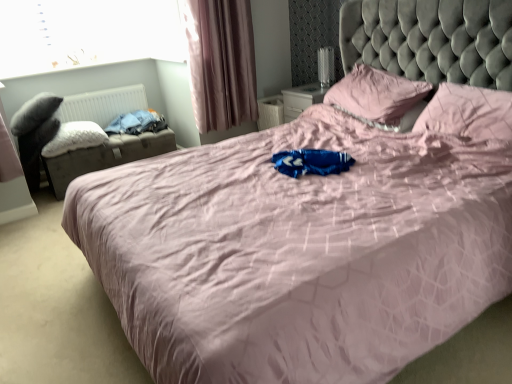
What do you see at coordinates (137, 123) in the screenshot? This screenshot has height=384, width=512. I see `blue cotton clothes at left` at bounding box center [137, 123].

The width and height of the screenshot is (512, 384). Find the location of `white fluffy pillow at left, placed as the 3th pillow when sorted from right to left`. white fluffy pillow at left, placed as the 3th pillow when sorted from right to left is located at coordinates (74, 138).

In order to click on velvet black swivel chair at left in this screenshot , I will do `click(35, 132)`.

Identify the location of pink fabric curtain at upper left. (221, 62).

Which is nearer, (x=85, y=16) or (x=46, y=128)?

Point (x=85, y=16) is farther from the camera than point (x=46, y=128).

Looking at their sizes, would you say transparent glass window at upper left is wider or thinner than velvet black swivel chair at left?

Clearly, transparent glass window at upper left has less width compared to velvet black swivel chair at left.

From the image's perspective, is transparent glass window at upper left beneath velvet black swivel chair at left?

Actually, transparent glass window at upper left appears above velvet black swivel chair at left in the image.

From a real-world perspective, who is located higher, transparent glass window at upper left or velvet black swivel chair at left?

From a 3D spatial view, transparent glass window at upper left is above.

Does pink fabric pillow at upper center, the 2th pillow in the left-to-right sequence, turn towards white fluffy pillow at left, placed as the 3th pillow when sorted from right to left?

No, pink fabric pillow at upper center, the 2th pillow in the left-to-right sequence, is not oriented towards white fluffy pillow at left, placed as the 3th pillow when sorted from right to left.

This screenshot has width=512, height=384. I want to click on pillow that appears above the white fluffy pillow at left, placed as the 3th pillow when sorted from right to left (from the image's perspective), so click(379, 98).

In terms of height, does pink fabric pillow at upper center, the second pillow in the right-to-left sequence, look taller or shorter compared to white fluffy pillow at left, the 1th pillow viewed from the left?

In the image, pink fabric pillow at upper center, the second pillow in the right-to-left sequence, appears to be taller than white fluffy pillow at left, the 1th pillow viewed from the left.

Is transparent glass window at upper left aimed at pink fabric curtain at upper left?

Yes, transparent glass window at upper left is aimed at pink fabric curtain at upper left.

Can we say transparent glass window at upper left lies outside pink fabric curtain at upper left?

transparent glass window at upper left lies outside pink fabric curtain at upper left's area.

Does transparent glass window at upper left have a lesser width compared to pink fabric curtain at upper left?

Yes.

Is transparent glass window at upper left not near pink fabric curtain at upper left?

No, transparent glass window at upper left is not far from pink fabric curtain at upper left.

Which of these two, leatherette storage ottoman at left or pink fabric curtain at upper left, stands taller?

Standing taller between the two is pink fabric curtain at upper left.

Can we say leatherette storage ottoman at left lies outside pink fabric curtain at upper left?

Yes, leatherette storage ottoman at left is outside of pink fabric curtain at upper left.

Which is closer, [79,171] or [204,88]?

Point [79,171] is closer to the camera than point [204,88].

Consider the image. Who is more distant, leatherette storage ottoman at left or pink fabric curtain at upper left?

leatherette storage ottoman at left is further from the camera.

Locate an element on the screen. pillow that is the 2nd object above the velvet black swivel chair at left (from a real-world perspective) is located at coordinates pyautogui.click(x=379, y=98).

Between velvet black swivel chair at left and pink fabric pillow at upper center, the second pillow in the right-to-left sequence, which one has smaller width?

Thinner between the two is pink fabric pillow at upper center, the second pillow in the right-to-left sequence.

Is velvet black swivel chair at left to the right of pink fabric pillow at upper center, the 2th pillow in the left-to-right sequence, from the viewer's perspective?

No, velvet black swivel chair at left is not to the right of pink fabric pillow at upper center, the 2th pillow in the left-to-right sequence.

Consider the image. Does velvet black swivel chair at left have a lesser height compared to white plastic radiator at left?

No, velvet black swivel chair at left is not shorter than white plastic radiator at left.

What are the coordinates of `radiator on the right of velvet black swivel chair at left` in the screenshot? It's located at (103, 105).

In the scene shown: Which is more distant, [11,125] or [96,118]?

Point [96,118]

Consider the image. Could blue cotton clothes at left be considered to be inside pink fabric pillow at upper center, the second pillow in the right-to-left sequence?

Actually, blue cotton clothes at left is outside pink fabric pillow at upper center, the second pillow in the right-to-left sequence.

Is pink fabric pillow at upper center, the 2th pillow in the left-to-right sequence, aimed at blue cotton clothes at left?

No, pink fabric pillow at upper center, the 2th pillow in the left-to-right sequence, is not oriented towards blue cotton clothes at left.

Considering their positions, is pink fabric pillow at upper center, the second pillow in the right-to-left sequence, located in front of or behind blue cotton clothes at left?

pink fabric pillow at upper center, the second pillow in the right-to-left sequence, is positioned closer to the viewer than blue cotton clothes at left.

Which of these two, pink fabric pillow at upper center, the 2th pillow in the left-to-right sequence, or blue cotton clothes at left, is smaller?

With smaller size is blue cotton clothes at left.

Image resolution: width=512 pixels, height=384 pixels. What are the coordinates of `swivel chair directly beneath the transparent glass window at upper left (from a real-world perspective)` in the screenshot? It's located at (x=35, y=132).

Locate an element on the screen. The height and width of the screenshot is (384, 512). the 1st pillow counting from the right side of the white fluffy pillow at left, the 1th pillow viewed from the left is located at coordinates (379, 98).

Based on their spatial positions, is velvet black swivel chair at left or pink fabric pillow at upper center, the 2th pillow in the left-to-right sequence, further from pink fabric curtain at upper left?

velvet black swivel chair at left.

From the image, which object appears to be nearer to pink fabric curtain at upper left, pink fabric pillow at upper right, the 3th pillow when ordered from left to right, or pink fabric pillow at upper center, the second pillow in the right-to-left sequence?

pink fabric pillow at upper center, the second pillow in the right-to-left sequence, lies closer to pink fabric curtain at upper left than the other object.

When comparing their distances from velvet black swivel chair at left, does white fluffy pillow at left, placed as the 3th pillow when sorted from right to left, or blue cotton clothes at left seem further?

Among the two, blue cotton clothes at left is located further to velvet black swivel chair at left.

From the image, which object appears to be nearer to transparent glass window at upper left, blue cotton clothes at left or velvet black swivel chair at left?

Among the two, blue cotton clothes at left is located nearer to transparent glass window at upper left.

Considering their positions, is blue cotton clothes at left positioned closer to pink fabric pillow at upper right, the 3th pillow when ordered from left to right, than transparent glass window at upper left?

Among the two, blue cotton clothes at left is located nearer to pink fabric pillow at upper right, the 3th pillow when ordered from left to right.

When comparing their distances from pink fabric pillow at upper right, the 3th pillow when ordered from left to right, does leatherette storage ottoman at left or white plastic radiator at left seem further?

Among the two, white plastic radiator at left is located further to pink fabric pillow at upper right, the 3th pillow when ordered from left to right.

When comparing their distances from white plastic radiator at left, does velvet black swivel chair at left or blue cotton clothes at left seem closer?

blue cotton clothes at left is positioned closer to the anchor white plastic radiator at left.

Based on their spatial positions, is pink fabric pillow at upper right, positioned as the 1th pillow in right-to-left order, or blue cotton clothes at left further from leatherette storage ottoman at left?

pink fabric pillow at upper right, positioned as the 1th pillow in right-to-left order, is positioned further to the anchor leatherette storage ottoman at left.

Where is `curtain between blue cotton clothes at left and pink fabric pillow at upper right, the 3th pillow when ordered from left to right, from left to right`? The height and width of the screenshot is (384, 512). curtain between blue cotton clothes at left and pink fabric pillow at upper right, the 3th pillow when ordered from left to right, from left to right is located at coordinates (221, 62).

Where is `the footrest located between white plastic radiator at left and pink fabric pillow at upper center, the second pillow in the right-to-left sequence, in the left-right direction`? Image resolution: width=512 pixels, height=384 pixels. the footrest located between white plastic radiator at left and pink fabric pillow at upper center, the second pillow in the right-to-left sequence, in the left-right direction is located at coordinates (105, 157).

At what (x,y) coordinates should I click in order to perform the action: click on footrest between white plastic radiator at left and pink fabric curtain at upper left from left to right. Please return your answer as a coordinate pair (x, y). The height and width of the screenshot is (384, 512). Looking at the image, I should click on (105, 157).

Locate an element on the screen. This screenshot has height=384, width=512. window screen between velvet black swivel chair at left and pink fabric pillow at upper center, the second pillow in the right-to-left sequence, from left to right is located at coordinates (86, 34).